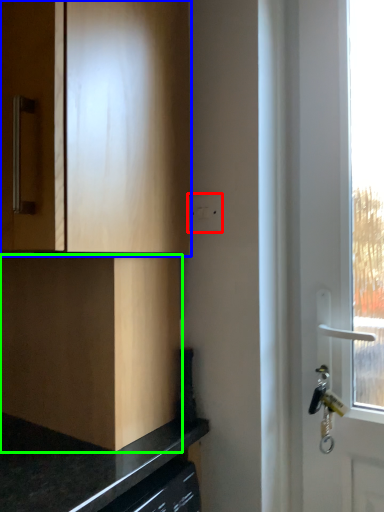
Question: Based on their relative distances, which object is farther from electric outlet (highlighted by a red box)? Choose from cabinetry (highlighted by a blue box) and cabinetry (highlighted by a green box).

Choices:
 (A) cabinetry
 (B) cabinetry

Answer: (B)